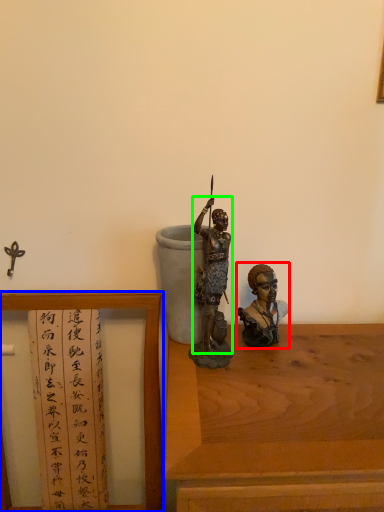
Question: Which object is the closest to the person (highlighted by a red box)? Choose among these: furniture (highlighted by a blue box) or person (highlighted by a green box).

Choices:
 (A) furniture
 (B) person

Answer: (B)